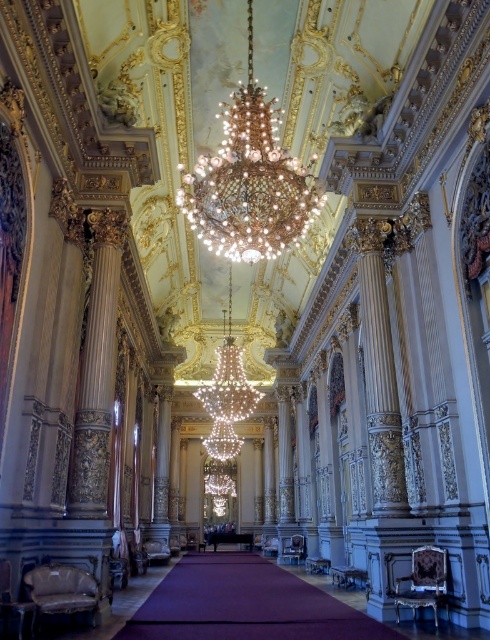
You are standing in the grand hall and want to determine which of the two points, point (390, 362) or point (157, 442), is closer to your current position. Based on the image, which point is nearer to you?

Point (390, 362) is closer to the camera than point (157, 442), so it is nearer to your current position.

You are an interior designer planning to install a new lighting fixture in this grand space. You have two options available for placement at the center of the room. The first option is the shiny crystal chandelier at center, and the second is the white marble column at center. Considering the existing size relationship between these two objects, which one would you choose to ensure it doesn

The shiny crystal chandelier at center is bigger than the white marble column at center. Therefore, if you want a larger central fixture, choose the shiny crystal chandelier at center. If you prefer a more compact option, select the white marble column at center.